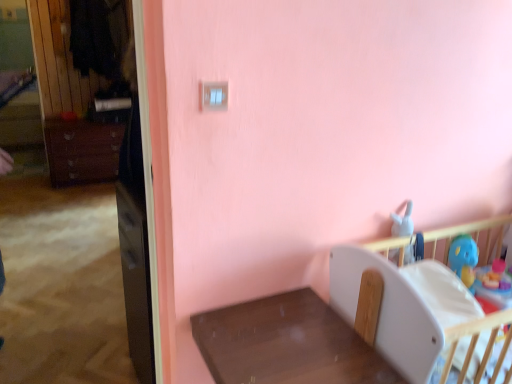
Locate an element on the screen. blank space above brown wooden table at lower center (from a real-world perspective) is located at coordinates (267, 353).